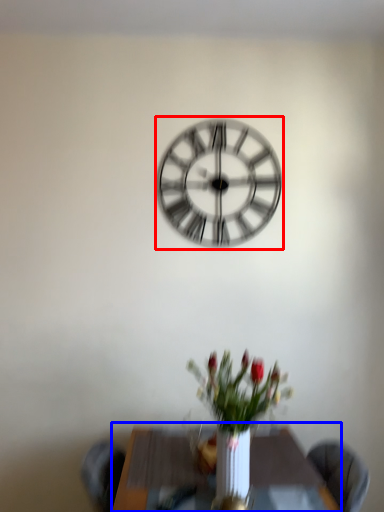
Question: Which point is closer to the camera, wall clock (highlighted by a red box) or table (highlighted by a blue box)?

Choices:
 (A) wall clock
 (B) table

Answer: (B)